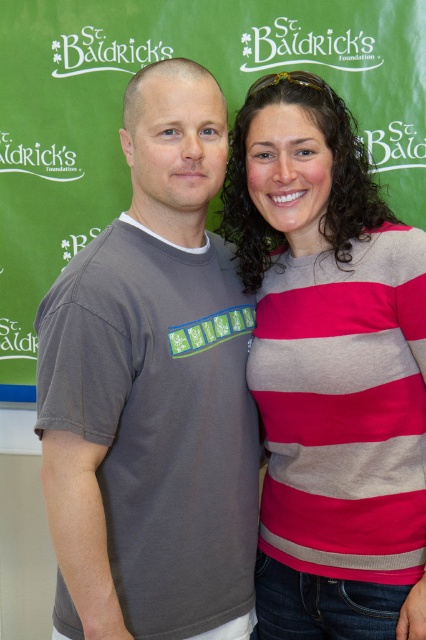
You are taking a photo of the striped sweater at right and the white matte text at upper center. Which object is nearer to the camera?

The striped sweater at right is closer to the viewer than the white matte text at upper center, so the striped sweater at right is nearer to the camera.

Based on the photo, you are designing a layout for a promotional poster and want to ensure that the striped sweater at right and the white matte text at upper center are positioned correctly. Based on the image, which object should be placed farther to the right to maintain their original spatial relationship?

The striped sweater at right should be placed farther to the right than the white matte text at upper center because in the original image, the striped sweater at right is positioned to the right of the white matte text at upper center.